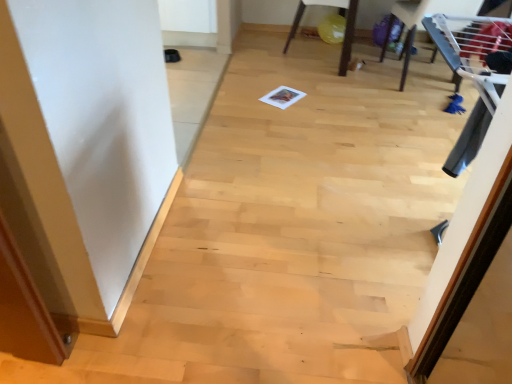
The height and width of the screenshot is (384, 512). I want to click on yellow rubber ball under table at upper center, so click(345, 28).

Image resolution: width=512 pixels, height=384 pixels. What do you see at coordinates (345, 28) in the screenshot?
I see `yellow rubber ball under table at upper center` at bounding box center [345, 28].

Where is `yellow rubber ball under table at upper center`? This screenshot has width=512, height=384. yellow rubber ball under table at upper center is located at coordinates (345, 28).